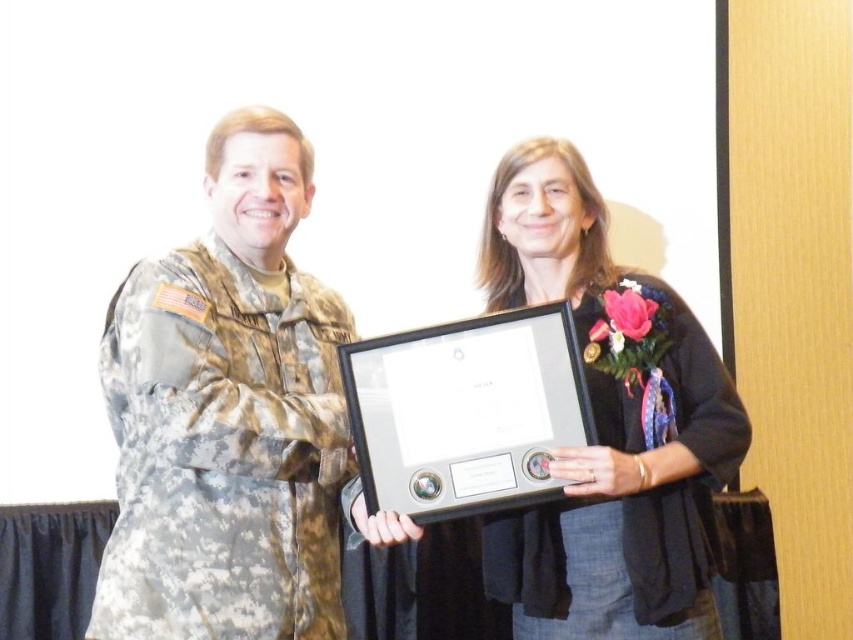
You are a photographer at an award ceremony. You need to capture a photo of the camouflage fabric uniform at left and the matte black uniform at center. Which uniform should you focus on if you want to highlight the larger one?

The camouflage fabric uniform at left is larger than the matte black uniform at center, so you should focus on the camouflage fabric uniform at left to highlight its larger size.

You are a photographer at an award ceremony. You need to capture a clear photo of both the camouflage fabric uniform at left and the matte black uniform at center. Since the camera can only focus on one subject at a time, which uniform should you focus on first to ensure the closest subject is in focus?

The camouflage fabric uniform at left is closer to the viewer than the matte black uniform at center, so you should focus on the camouflage fabric uniform at left first to ensure it is in focus.

You are an event photographer at a formal award ceremony. You need to capture a photo of the matte black frame at center and the camouflage fabric uniform at left. The camera you are using has a limited focus range. Can you fit both objects into the frame without moving the camera?

The matte black frame at center has a greater height compared to the camouflage fabric uniform at left, so if the camera can focus on objects of varying heights within its limited range, both can be included. However, if the focus range is strictly depth related, their proximity might allow inclusion without moving the camera.